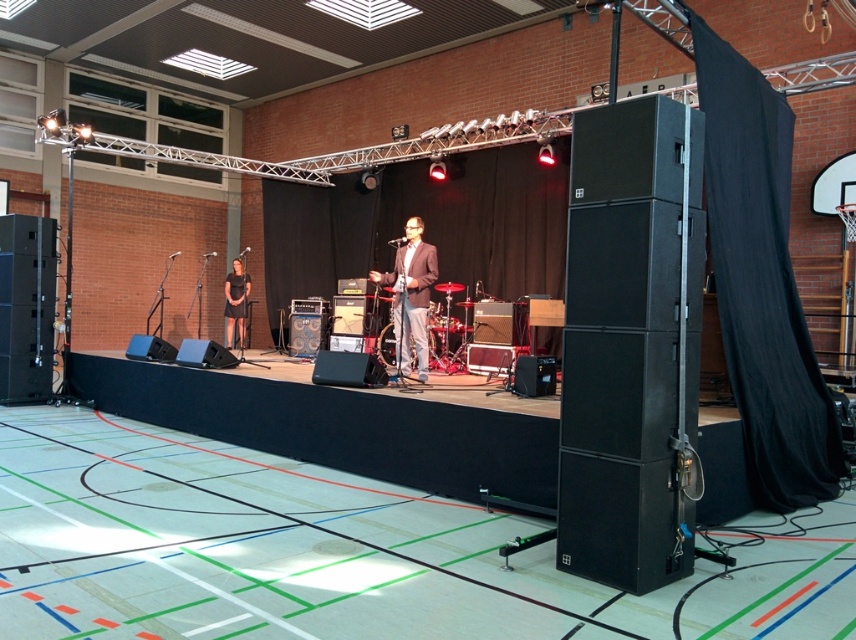
You are an event organizer checking the stage layout. You need to ensure that the performers have enough space to move around. Given the descriptions of the matte black suit at center and dark gray dress at stage left, which performer is taking up more space on the stage?

The dark gray dress at stage left occupies more space than the matte black suit at center.

In the scene shown: You are an event planner standing at the entrance of the gymnasium. You need to locate the matte black suit at center on the stage. Based on the coordinates provided, where should you look to find it?

The matte black suit at center is located at coordinates point (409, 296) on the stage.